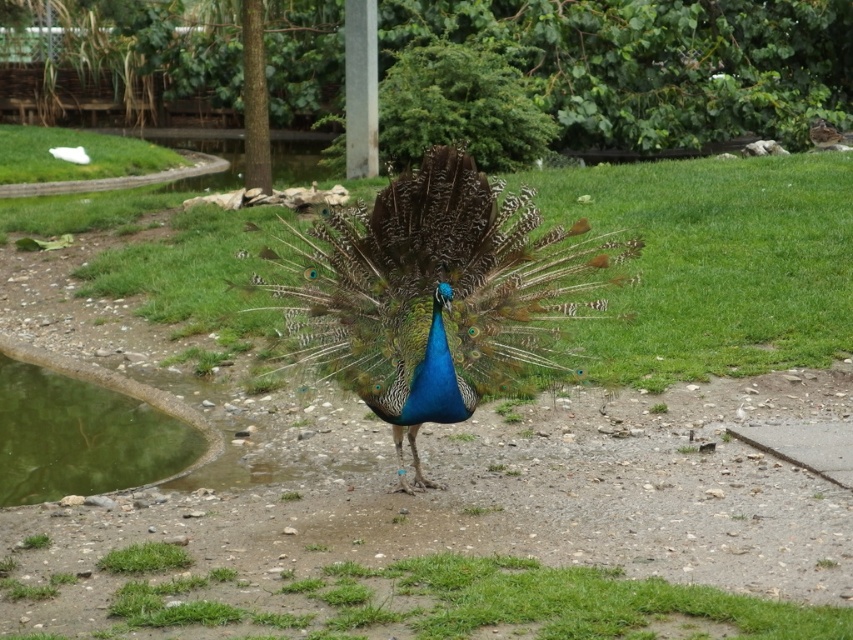
Can you confirm if green grass at center is taller than green reflective water at lower left?

Incorrect, green grass at center's height is not larger of green reflective water at lower left's.

Can you confirm if green grass at center is positioned to the left of green reflective water at lower left?

Incorrect, green grass at center is not on the left side of green reflective water at lower left.

Between point (212, 577) and point (113, 488), which one is positioned in front?

Point (212, 577) is in front.

Where is `green grass at center`? The image size is (853, 640). green grass at center is located at coordinates (442, 602).

Can you confirm if shiny blue peacock at center is positioned below green reflective water at lower left?

No, shiny blue peacock at center is not below green reflective water at lower left.

I want to click on shiny blue peacock at center, so click(x=436, y=292).

Consider the image. Who is taller, shiny blue peacock at center or green grass at center?

shiny blue peacock at center

Is shiny blue peacock at center closer to the viewer compared to green grass at center?

No, shiny blue peacock at center is behind green grass at center.

What do you see at coordinates (436, 292) in the screenshot? I see `shiny blue peacock at center` at bounding box center [436, 292].

Where is `shiny blue peacock at center`? shiny blue peacock at center is located at coordinates (436, 292).